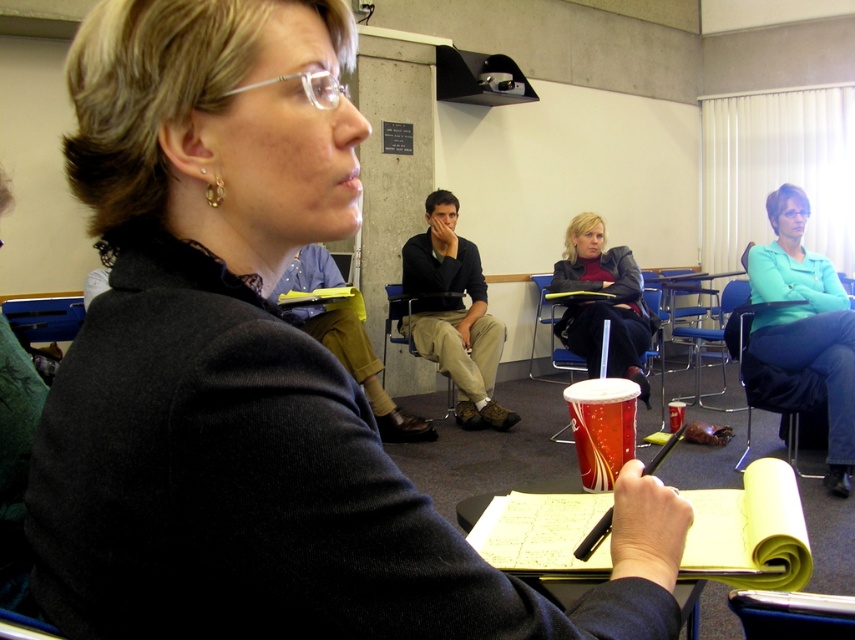
In the classroom scene, there is a point at coordinates (x=777, y=387). Based on the description, which object from the scene does this point correspond to?

The point at coordinates (x=777, y=387) corresponds to the blue fabric chair at right.

You are a person sitting in the matte plastic chair at center in a classroom. You want to reach the matte black jacket at center to grab a pen. Can you comfortably reach it while sitting?

The matte black jacket at center is 33.48 inches away from the matte plastic chair at center. Since the average arm length for an adult is about 25 to 30 inches, you would not be able to comfortably reach the matte black jacket at center from the matte plastic chair at center while sitting.

You are a person sitting in the classroom and want to place a book on the seat of the matte plastic chair at center. Can you do that without disturbing the matte black jacket at center?

The matte black jacket at center is located above the matte plastic chair at center, so placing a book on the seat would require moving the jacket first to avoid disturbing it.